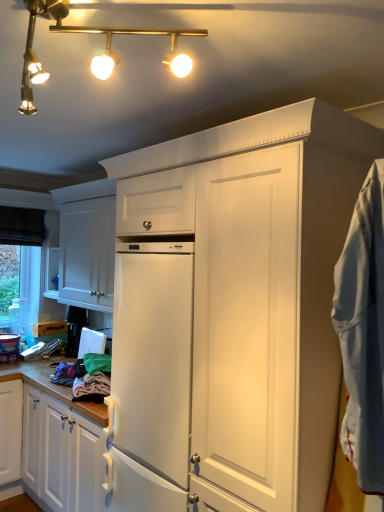
Question: Is gold metallic track lights at upper left at the left side of white matte cabinet at upper left?

Choices:
 (A) yes
 (B) no

Answer: (B)

Question: Considering the relative sizes of gold metallic track lights at upper left and white matte cabinet at upper left in the image provided, is gold metallic track lights at upper left thinner than white matte cabinet at upper left?

Choices:
 (A) no
 (B) yes

Answer: (A)

Question: Is gold metallic track lights at upper left positioned far away from white matte cabinet at upper left?

Choices:
 (A) yes
 (B) no

Answer: (A)

Question: Could you tell me if gold metallic track lights at upper left is facing white matte cabinet at upper left?

Choices:
 (A) no
 (B) yes

Answer: (A)

Question: Can you confirm if gold metallic track lights at upper left is smaller than white matte cabinet at upper left?

Choices:
 (A) no
 (B) yes

Answer: (B)

Question: Would you say white matte cabinet at upper left is inside or outside gold metallic track lights at upper left?

Choices:
 (A) outside
 (B) inside

Answer: (A)

Question: Considering the relative positions of white matte cabinet at upper left and gold metallic track lights at upper left in the image provided, is white matte cabinet at upper left to the left or to the right of gold metallic track lights at upper left?

Choices:
 (A) left
 (B) right

Answer: (A)

Question: From a real-world perspective, relative to gold metallic track lights at upper left, is white matte cabinet at upper left vertically above or below?

Choices:
 (A) below
 (B) above

Answer: (A)

Question: From their relative heights in the image, would you say white matte cabinet at upper left is taller or shorter than gold metallic track lights at upper left?

Choices:
 (A) tall
 (B) short

Answer: (A)

Question: Is white cotton blanket at right to the left or to the right of white matte cabinet at upper left in the image?

Choices:
 (A) left
 (B) right

Answer: (B)

Question: From the image's perspective, is white cotton blanket at right located above or below white matte cabinet at upper left?

Choices:
 (A) above
 (B) below

Answer: (B)

Question: In terms of size, does white cotton blanket at right appear bigger or smaller than white matte cabinet at upper left?

Choices:
 (A) small
 (B) big

Answer: (A)

Question: In terms of height, does white cotton blanket at right look taller or shorter compared to white matte cabinet at upper left?

Choices:
 (A) tall
 (B) short

Answer: (A)

Question: Based on their sizes in the image, would you say white cotton blanket at right is bigger or smaller than gold metallic track lights at upper left?

Choices:
 (A) big
 (B) small

Answer: (B)

Question: Would you say white cotton blanket at right is to the left or to the right of gold metallic track lights at upper left in the picture?

Choices:
 (A) right
 (B) left

Answer: (A)